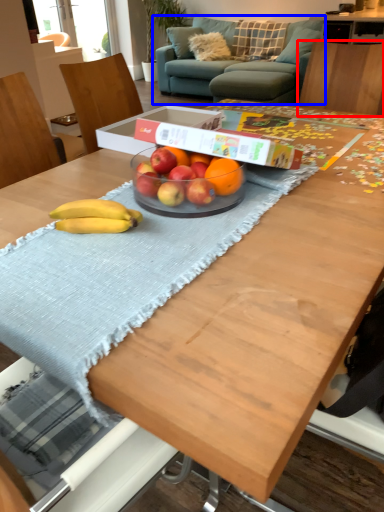
Question: Among these objects, which one is farthest to the camera, chair (highlighted by a red box) or studio couch (highlighted by a blue box)?

Choices:
 (A) chair
 (B) studio couch

Answer: (B)